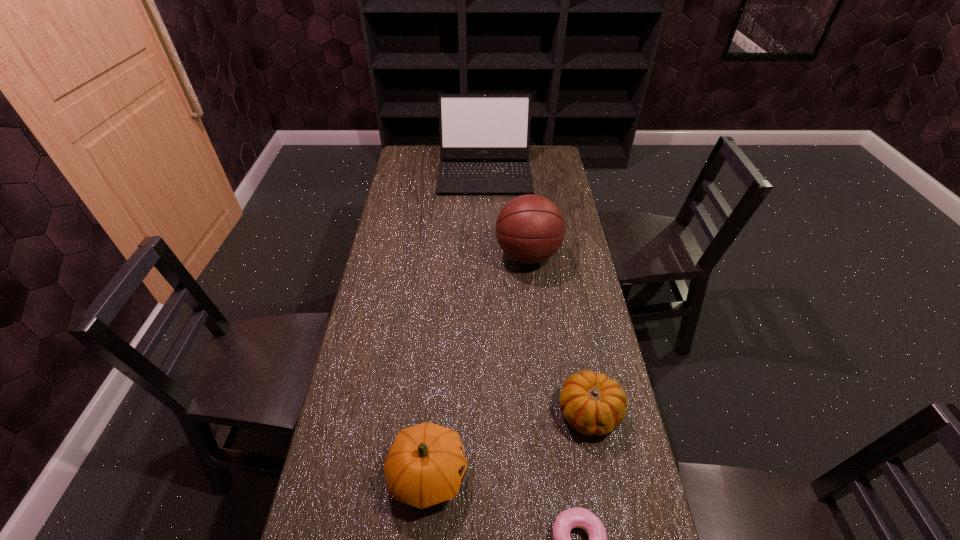
Where is `free spot between the second shortest object and the basketball`? The image size is (960, 540). free spot between the second shortest object and the basketball is located at coordinates (559, 334).

Find the location of `vacant space that is in between the laptop and the fourth tallest object`. vacant space that is in between the laptop and the fourth tallest object is located at coordinates (538, 292).

Find the location of a particular element. The height and width of the screenshot is (540, 960). free space between the taller gourd and the second shortest object is located at coordinates (509, 443).

This screenshot has width=960, height=540. What are the coordinates of `free space between the left gourd and the shorter gourd` in the screenshot? It's located at (509, 443).

Identify the location of object that is the second closest one to the fourth nearest object. This screenshot has width=960, height=540. (593, 404).

Point out which object is positioned as the third nearest to the second farthest object. Please provide its 2D coordinates. Your answer should be formatted as a tuple, i.e. [(x, y)], where the tuple contains the x and y coordinates of a point satisfying the conditions above.

[(425, 466)]

Where is `vacant space that satisfies the following two spatial constraints: 1. on the surface of the farthest object; 2. on the left side of the shorter gourd`? vacant space that satisfies the following two spatial constraints: 1. on the surface of the farthest object; 2. on the left side of the shorter gourd is located at coordinates (488, 412).